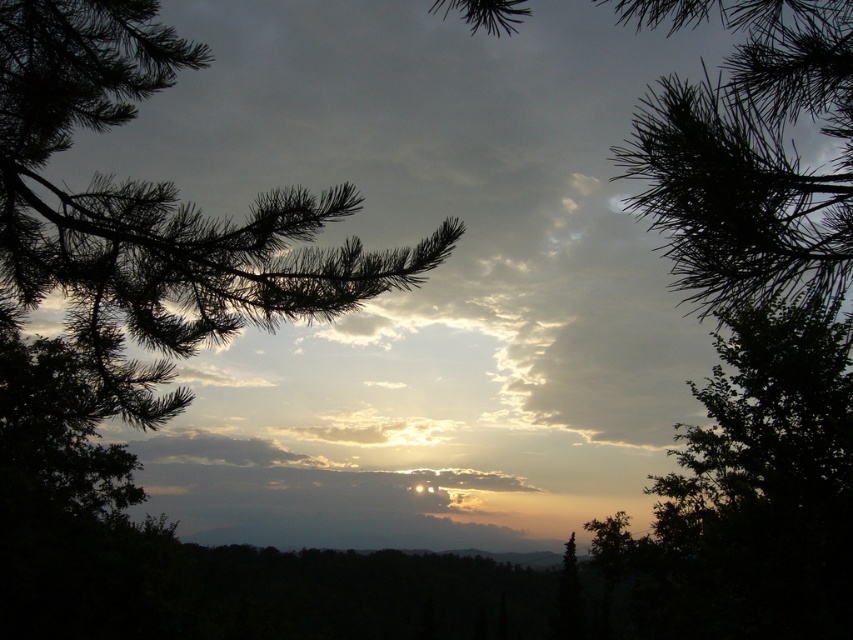
How much distance is there between silvery needles at center and dark green needles at center?

silvery needles at center is 6.47 meters away from dark green needles at center.

Based on the photo, who is taller, silvery needles at center or dark green needles at center?

dark green needles at center

Is point (136, 193) positioned behind point (776, 72)?

No, (136, 193) is in front of (776, 72).

What are the coordinates of `silvery needles at center` in the screenshot? It's located at (142, 228).